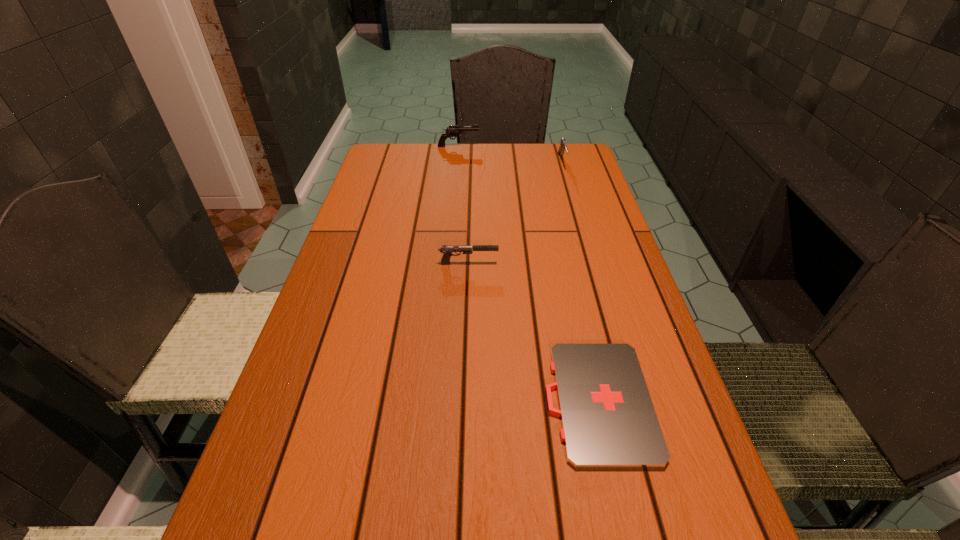
Locate an element on the screen. The image size is (960, 540). free space located on handle side the nearest object is located at coordinates (519, 402).

Locate an element on the screen. The height and width of the screenshot is (540, 960). vacant point located on handle side the nearest object is located at coordinates (475, 402).

This screenshot has width=960, height=540. In order to click on free region located on handle side the nearest object in this screenshot , I will do `click(443, 402)`.

The width and height of the screenshot is (960, 540). Identify the location of gun positioned at the right edge. (562, 142).

Where is `the first-aid kit that is at the right edge`? the first-aid kit that is at the right edge is located at coordinates (608, 420).

What are the coordinates of `object present at the far right corner` in the screenshot? It's located at (562, 142).

At what (x,y) coordinates should I click in order to perform the action: click on vacant space at the far edge of the desktop. Please return your answer as a coordinate pair (x, y). This screenshot has height=540, width=960. Looking at the image, I should click on (485, 167).

Where is `vacant space at the left edge of the desktop`? vacant space at the left edge of the desktop is located at coordinates coord(411,181).

The width and height of the screenshot is (960, 540). Identify the location of vacant space at the right edge of the desktop. (567, 287).

This screenshot has height=540, width=960. I want to click on free space at the far right corner of the desktop, so click(548, 168).